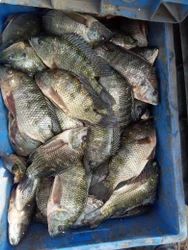
The width and height of the screenshot is (188, 250). I want to click on plastic bin, so pyautogui.click(x=161, y=236).